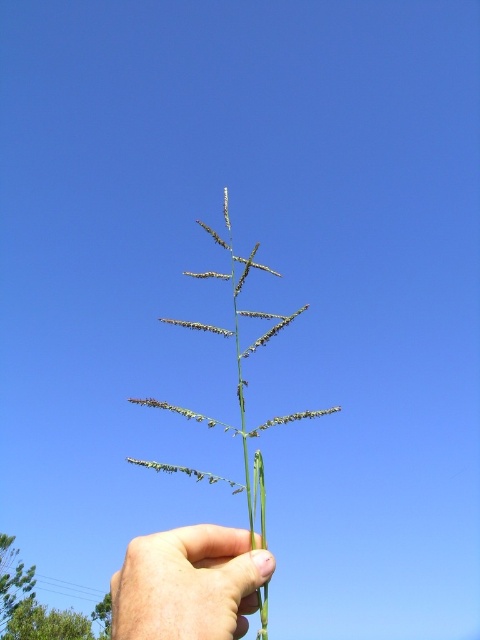
Question: Among these objects, which one is farthest from the camera?

Choices:
 (A) green grass at center
 (B) skinny green stem at center

Answer: (A)

Question: Can you confirm if skinny green stem at center is positioned above green grass at center?

Choices:
 (A) no
 (B) yes

Answer: (A)

Question: Does skinny green stem at center appear on the right side of green grass at center?

Choices:
 (A) yes
 (B) no

Answer: (B)

Question: Does skinny green stem at center appear on the left side of green grass at center?

Choices:
 (A) yes
 (B) no

Answer: (A)